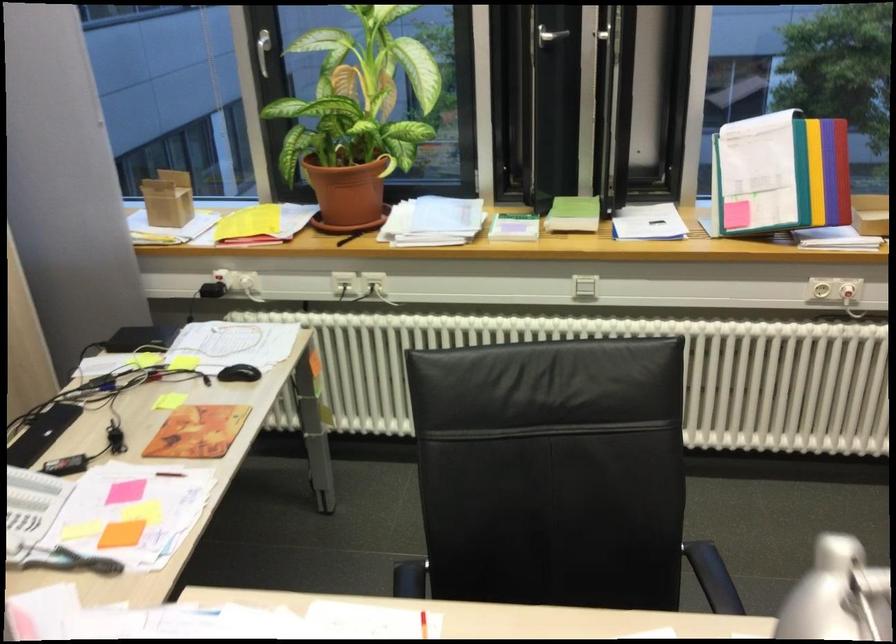
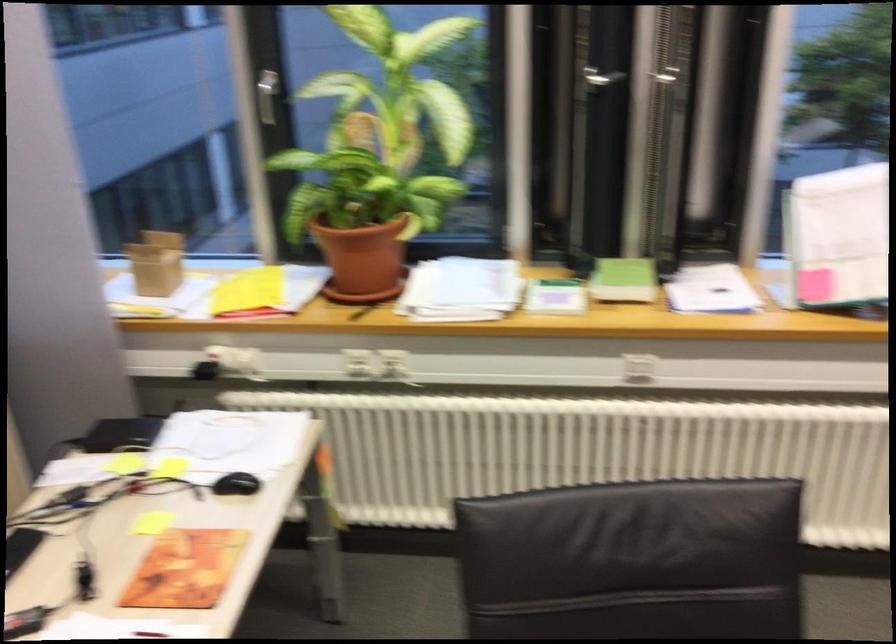
Find the pixel in the second image that matches the point at 573,212 in the first image.

(624, 279)